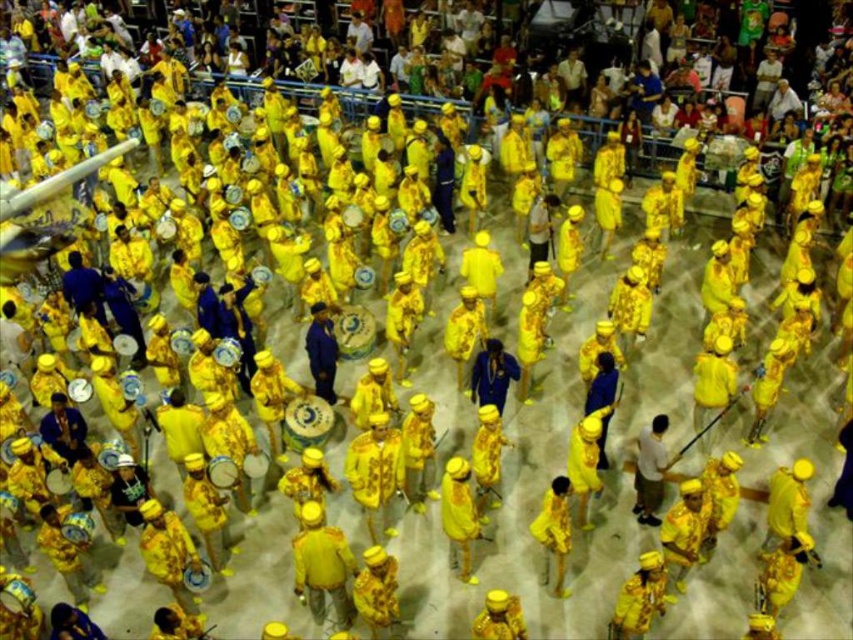
You are a photographer at the event and want to capture a photo where both the yellow fabric drum at center and the blue velvet suit at center are clearly visible. Given their heights, which object will appear larger in the photo?

The yellow fabric drum at center is taller than the blue velvet suit at center, so it will appear larger in the photo.

You are a participant in the parade and need to locate the yellow fabric drum at center. According to the coordinates provided, where exactly should you look to find it?

The yellow fabric drum at center is located at the coordinates point (375, 474).

You are standing in the crowd watching the lively drumming performance. There is a yellow matte hat at center that you want to take a photo of. If your camera has a focal length of 50mm and you want to fill the frame with the hat, would you need to zoom in or out?

The yellow matte hat at center is 28.59 feet away. With a 50mm lens, which is considered standard focal length, you would need to zoom in slightly to fill the frame with the hat since it is relatively small and distant.